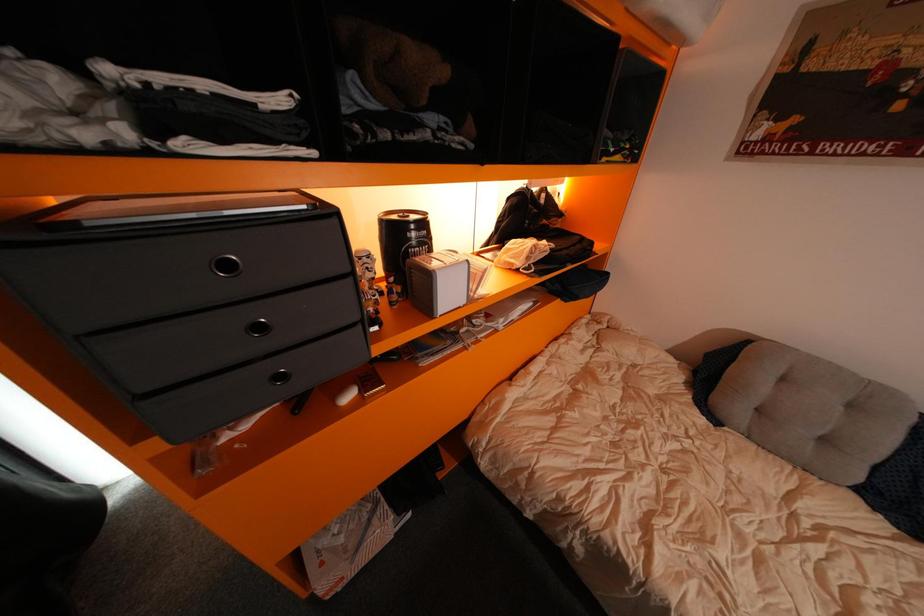
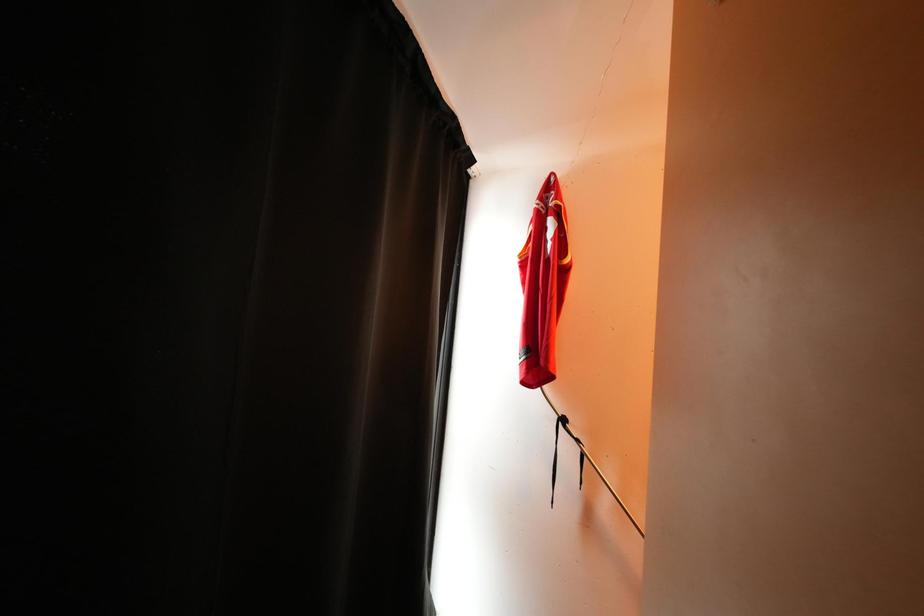
The first image is from the beginning of the video and the second image is from the end. How did the camera likely rotate when shooting the video?

The camera rotated toward left-up.